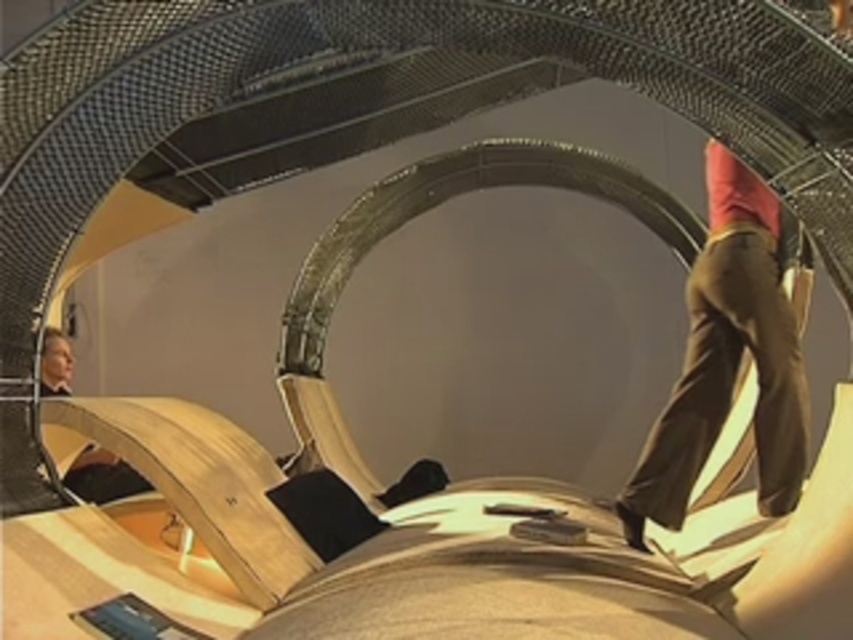
You are an interior designer assessing the spatial dimensions of the futuristic interior. You need to determine if the brown leather pants at right can be placed on top of the smooth beige suit at lower left without exceeding its height. Can this be done?

The brown leather pants at right is taller than the smooth beige suit at lower left. Therefore, placing the brown leather pants at right on top of the smooth beige suit at lower left would cause it to exceed the height of the latter, making it unsuitable for stacking.

You are an interior designer assessing the placement of furniture in this futuristic space. You notice the brown leather pants at right and the smooth beige suit at lower left. Which object is located higher up in the scene?

The brown leather pants at right is positioned over the smooth beige suit at lower left, meaning it is higher up in the scene.